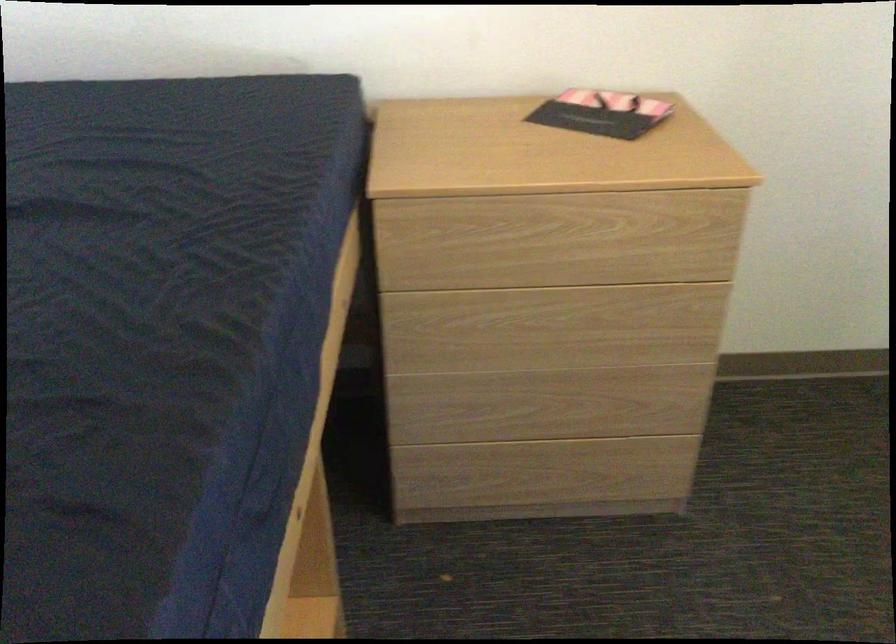
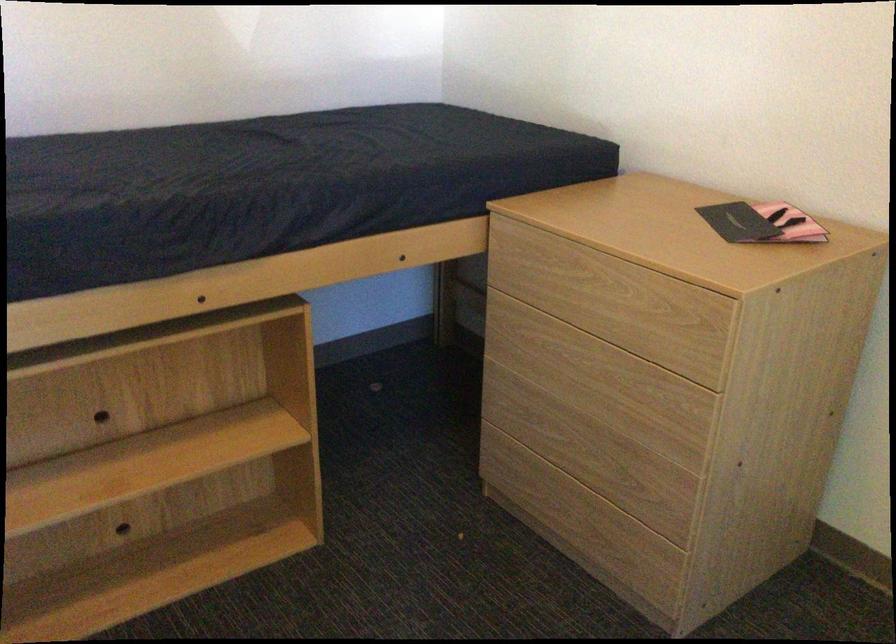
Find the pixel in the second image that matches point (554, 238) in the first image.

(582, 287)